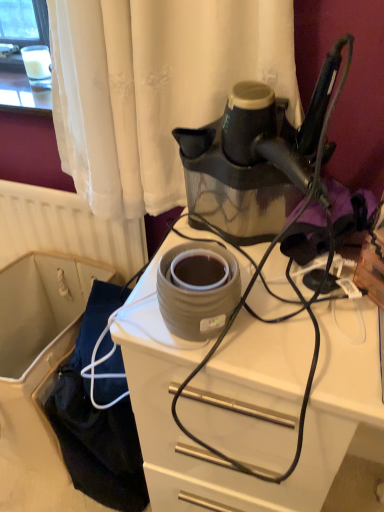
What do you see at coordinates (197, 297) in the screenshot? I see `matte gray ceramic pot at center` at bounding box center [197, 297].

The image size is (384, 512). In order to click on matte gray ceramic at center in this screenshot , I will do `click(305, 419)`.

Where is `black rubber cord at center`? black rubber cord at center is located at coordinates (297, 295).

Which of these two, matte gray ceramic pot at center or black rubber cord at center, is bigger?

With larger size is black rubber cord at center.

From a real-world perspective, does matte gray ceramic pot at center stand above black rubber cord at center?

Actually, matte gray ceramic pot at center is physically below black rubber cord at center in the real world.

Can you confirm if matte gray ceramic pot at center is thinner than black rubber cord at center?

Correct, the width of matte gray ceramic pot at center is less than that of black rubber cord at center.

The image size is (384, 512). I want to click on wire that appears above the matte gray ceramic pot at center (from a real-world perspective), so click(x=297, y=295).

Between black rubber cord at center and matte gray ceramic at center, which one has smaller width?

With smaller width is black rubber cord at center.

From a real-world perspective, is black rubber cord at center under matte gray ceramic at center?

No, from a real-world perspective, black rubber cord at center is not beneath matte gray ceramic at center.

Looking at this image, considering the relative sizes of black rubber cord at center and matte gray ceramic at center in the image provided, is black rubber cord at center bigger than matte gray ceramic at center?

Actually, black rubber cord at center might be smaller than matte gray ceramic at center.

Is black rubber cord at center behind matte gray ceramic at center?

No, it is not.

How different are the orientations of matte gray ceramic at center and matte gray ceramic pot at center in degrees?

1.29 degrees.

From a real-world perspective, is matte gray ceramic at center over matte gray ceramic pot at center?

No, from a real-world perspective, matte gray ceramic at center is not on top of matte gray ceramic pot at center.

Considering the points (138, 417) and (199, 304), which point is behind, point (138, 417) or point (199, 304)?

The point (138, 417) is behind.

Can you confirm if matte gray ceramic at center is bigger than matte gray ceramic pot at center?

Yes, matte gray ceramic at center is bigger than matte gray ceramic pot at center.

Which of these two, black rubber cord at center or matte gray ceramic pot at center, is smaller?

matte gray ceramic pot at center is smaller.

From the image's perspective, would you say black rubber cord at center is positioned over matte gray ceramic pot at center?

Correct, black rubber cord at center appears higher than matte gray ceramic pot at center in the image.

Is black rubber cord at center in front of matte gray ceramic pot at center?

Yes, the depth of black rubber cord at center is less than that of matte gray ceramic pot at center.

Is black rubber cord at center next to matte gray ceramic pot at center?

No, black rubber cord at center is not making contact with matte gray ceramic pot at center.

Considering the relative sizes of matte gray ceramic pot at center and matte gray ceramic at center in the image provided, is matte gray ceramic pot at center taller than matte gray ceramic at center?

No.

From the image's perspective, would you say matte gray ceramic pot at center is positioned over matte gray ceramic at center?

Correct, matte gray ceramic pot at center appears higher than matte gray ceramic at center in the image.

Where is `appliance that appears above the matte gray ceramic at center (from a real-world perspective)`? appliance that appears above the matte gray ceramic at center (from a real-world perspective) is located at coordinates (197, 297).

Can you confirm if matte gray ceramic at center is positioned to the left of black rubber cord at center?

In fact, matte gray ceramic at center is to the right of black rubber cord at center.

Consider the image. From the image's perspective, between matte gray ceramic at center and black rubber cord at center, which one is located above?

black rubber cord at center appears higher in the image.

From a real-world perspective, which object rests below the other?

In real-world perspective, matte gray ceramic at center is lower.

Is matte gray ceramic at center looking in the opposite direction of black rubber cord at center?

That's not correct — matte gray ceramic at center is not looking away from black rubber cord at center.

Identify the location of wire in front of the matte gray ceramic pot at center. Image resolution: width=384 pixels, height=512 pixels. pos(297,295).

The image size is (384, 512). I want to click on wire that is on the left side of matte gray ceramic at center, so click(x=297, y=295).

From the image, which object appears to be farther from black rubber cord at center, matte gray ceramic pot at center or matte gray ceramic at center?

matte gray ceramic pot at center is further to black rubber cord at center.

Which object lies further to the anchor point black rubber cord at center, matte gray ceramic at center or matte gray ceramic pot at center?

matte gray ceramic pot at center.

Looking at the image, which one is located further to matte gray ceramic pot at center, matte gray ceramic at center or black rubber cord at center?

The object further to matte gray ceramic pot at center is matte gray ceramic at center.

Which object lies nearer to the anchor point matte gray ceramic at center, black rubber cord at center or matte gray ceramic pot at center?

Among the two, black rubber cord at center is located nearer to matte gray ceramic at center.

From the image, which object appears to be nearer to matte gray ceramic at center, matte gray ceramic pot at center or black rubber cord at center?

black rubber cord at center lies closer to matte gray ceramic at center than the other object.

Looking at the image, which one is located closer to matte gray ceramic pot at center, black rubber cord at center or matte gray ceramic at center?

Among the two, black rubber cord at center is located nearer to matte gray ceramic pot at center.

I want to click on appliance between black rubber cord at center and matte gray ceramic at center in the vertical direction, so click(197, 297).